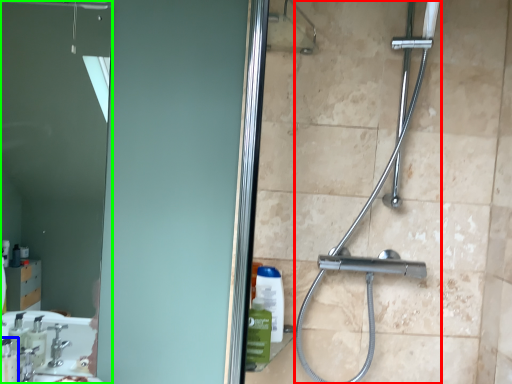
Question: Which is nearer to the shower (highlighted by a red box)? soap dispenser (highlighted by a blue box) or mirror (highlighted by a green box).

Choices:
 (A) soap dispenser
 (B) mirror

Answer: (A)